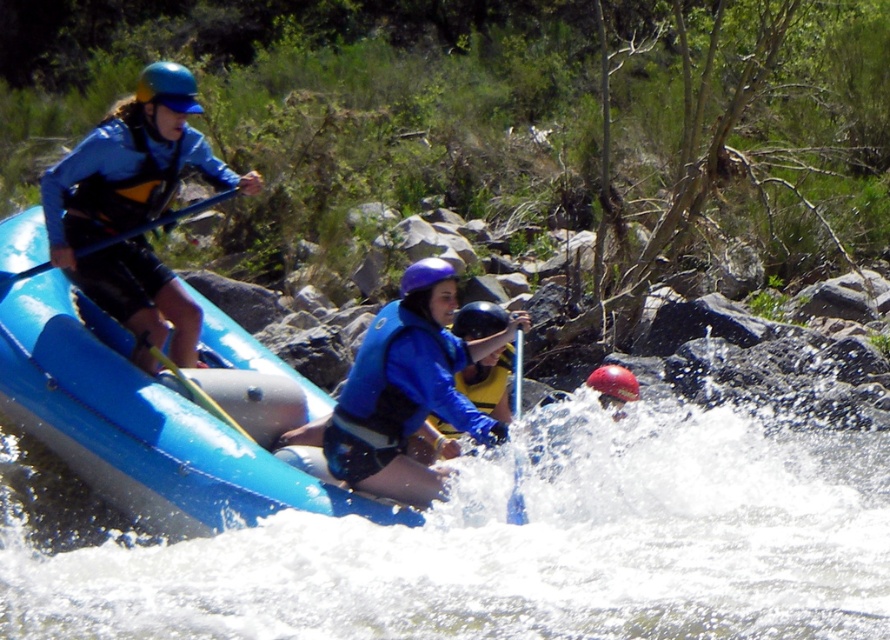
Between blue matte life vest at center and blue matte life jacket at center, which one is positioned higher?

blue matte life jacket at center

Consider the image. Between blue matte life vest at center and blue matte life jacket at center, which one appears on the right side from the viewer's perspective?

blue matte life jacket at center

Identify the location of blue matte life vest at center. (409, 388).

Does blue matte life jacket at center appear on the right side of shiny blue helmet at upper left?

Yes, blue matte life jacket at center is to the right of shiny blue helmet at upper left.

Is blue matte life jacket at center smaller than shiny blue helmet at upper left?

Yes, blue matte life jacket at center is smaller than shiny blue helmet at upper left.

What do you see at coordinates (490, 381) in the screenshot?
I see `blue matte life jacket at center` at bounding box center [490, 381].

Identify the location of blue matte life jacket at center. This screenshot has height=640, width=890. (490, 381).

Can you confirm if blue matte life vest at center is positioned above shiny blue helmet at upper left?

No.

From the picture: Between blue matte life vest at center and shiny blue helmet at upper left, which one is positioned higher?

shiny blue helmet at upper left is above.

Find the location of a particular element. The image size is (890, 640). blue matte life vest at center is located at coordinates (409, 388).